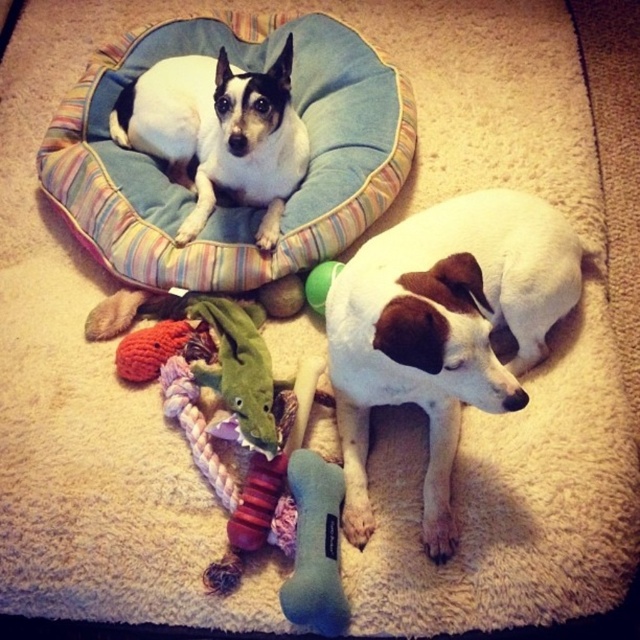
You are standing in the living room and want to place a 6 feet long ladder between the blue fabric dog bed at upper left and yourself. Is there enough space to fit the ladder without bending it?

The distance between the blue fabric dog bed at upper left and the viewer is 5.54 feet, which is shorter than the ladder length of 6 feet. Therefore, the ladder cannot be placed straight between them without bending.

You are a dog owner who wants to place a new dog bed for your pet. You have a blue fabric dog bed at upper left and a white soft dog at upper left in the room. Which object is taller and should be considered when placing the new bed?

The blue fabric dog bed at upper left is taller than the white soft dog at upper left, so you should consider the height of the blue fabric dog bed at upper left when placing the new bed to ensure there is enough space.

You are a dog owner trying to decide where to place a new dog bed. You want to ensure that the bed will be large enough for both the white soft dog at upper left and the green rubber ball at center. Based on their sizes, can you determine if the bed needs to accommodate a taller object?

The white soft dog at upper left is taller than the green rubber ball at center, so the bed must be tall enough to accommodate the white soft dog at upper left.